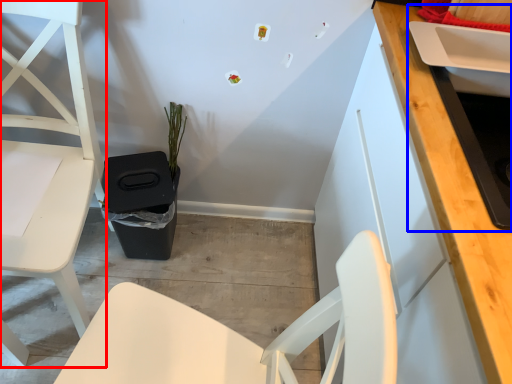
Question: Which of the following is the closest to the observer, chair (highlighted by a red box) or sink (highlighted by a blue box)?

Choices:
 (A) chair
 (B) sink

Answer: (B)